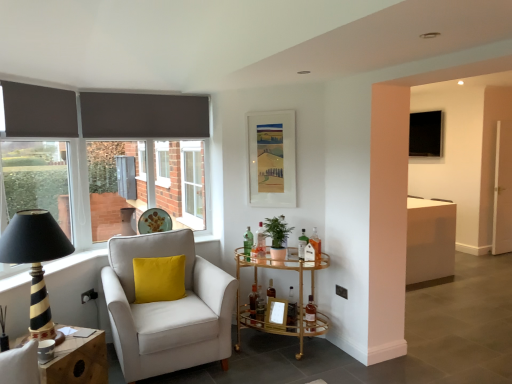
Measure the distance between green matte plant at center and camera.

They are 3.28 meters apart.

What is the approximate height of green glass bottle at center, the 3th bottle when ordered from left to right?

It is 13.46 inches.

Where is `green matte plant at center`? The image size is (512, 384). green matte plant at center is located at coordinates (277, 238).

Is point (345, 296) closer to camera compared to point (301, 245)?

No, (345, 296) is behind (301, 245).

From the image's perspective, which one is positioned higher, black plastic power outlet at lower right, which is the 2th power outlet in left-to-right order, or green glass bottle at center, the 3th bottle when ordered from right to left?

green glass bottle at center, the 3th bottle when ordered from right to left.

Which of these two, black plastic power outlet at lower right, placed as the 1th power outlet when sorted from right to left, or green glass bottle at center, the fifth bottle in the left-to-right sequence, is wider?

Wider between the two is green glass bottle at center, the fifth bottle in the left-to-right sequence.

How different are the orientations of black plastic power outlet at lower right, which is the 2th power outlet in left-to-right order, and green glass bottle at center, the 3th bottle when ordered from right to left, in degrees?

20.1 degrees separate the facing orientations of black plastic power outlet at lower right, which is the 2th power outlet in left-to-right order, and green glass bottle at center, the 3th bottle when ordered from right to left.

Who is more distant, yellow velvet pillow at center or green glass bottle at center, the 3th bottle when ordered from right to left?

green glass bottle at center, the 3th bottle when ordered from right to left, is more distant.

Would you consider yellow velvet pillow at center to be distant from green glass bottle at center, the fifth bottle in the left-to-right sequence?

Yes, yellow velvet pillow at center is far from green glass bottle at center, the fifth bottle in the left-to-right sequence.

Is yellow velvet pillow at center positioned beyond the bounds of green glass bottle at center, the 3th bottle when ordered from right to left?

That's correct, yellow velvet pillow at center is outside of green glass bottle at center, the 3th bottle when ordered from right to left.

Is yellow velvet pillow at center to the left of green glass bottle at center, the fifth bottle in the left-to-right sequence, from the viewer's perspective?

Correct, you'll find yellow velvet pillow at center to the left of green glass bottle at center, the fifth bottle in the left-to-right sequence.

From a real-world perspective, which is physically below, black plastic power outlet at lower left, arranged as the 2th power outlet when viewed from the right, or black glossy television at upper right?

black plastic power outlet at lower left, arranged as the 2th power outlet when viewed from the right, from a real-world perspective.

Is black plastic power outlet at lower left, the first power outlet in the left-to-right sequence, wider than black glossy television at upper right?

No, black plastic power outlet at lower left, the first power outlet in the left-to-right sequence, is not wider than black glossy television at upper right.

From the image's perspective, is black plastic power outlet at lower left, arranged as the 2th power outlet when viewed from the right, located above or below black glossy television at upper right?

Based on their image positions, black plastic power outlet at lower left, arranged as the 2th power outlet when viewed from the right, is located beneath black glossy television at upper right.

Would you consider black plastic power outlet at lower left, the first power outlet in the left-to-right sequence, to be distant from black glossy television at upper right?

Indeed, black plastic power outlet at lower left, the first power outlet in the left-to-right sequence, is not near black glossy television at upper right.

Considering the sizes of yellow velvet pillow at center and black glossy television at upper right in the image, is yellow velvet pillow at center wider or thinner than black glossy television at upper right?

yellow velvet pillow at center is wider than black glossy television at upper right.

Looking at this image, measure the distance between yellow velvet pillow at center and black glossy television at upper right.

They are 15.69 feet apart.

Locate an element on the screen. pillow on the left of black glossy television at upper right is located at coordinates (159, 279).

Can you confirm if yellow velvet pillow at center is taller than black glossy television at upper right?

No.

Can you confirm if white glass door at right is bigger than gold glass bar cart at center, the 2th table positioned from the left?

No.

Identify the location of glass door lying behind the gold glass bar cart at center, positioned as the first table in right-to-left order. (503, 190).

Considering the relative positions of white glass door at right and gold glass bar cart at center, positioned as the first table in right-to-left order, in the image provided, is white glass door at right behind gold glass bar cart at center, positioned as the first table in right-to-left order,?

Yes, white glass door at right is further from the camera.

Would you consider white plastic window frame at center to be distant from translucent amber glass bottle at center, the 6th bottle viewed from the left?

Indeed, white plastic window frame at center is not near translucent amber glass bottle at center, the 6th bottle viewed from the left.

This screenshot has height=384, width=512. I want to click on the 6th bottle in front of the white plastic window frame at center, so click(x=310, y=315).

Considering the sizes of objects white plastic window frame at center and translucent amber glass bottle at center, which is counted as the second bottle, starting from the right, in the image provided, who is thinner, white plastic window frame at center or translucent amber glass bottle at center, which is counted as the second bottle, starting from the right,?

translucent amber glass bottle at center, which is counted as the second bottle, starting from the right, is thinner.

Looking at this image, is translucent amber glass bottle at center, which is counted as the second bottle, starting from the right, a part of white plastic window frame at center?

No, translucent amber glass bottle at center, which is counted as the second bottle, starting from the right, is not surrounded by white plastic window frame at center.

Is yellow velvet pillow at center directly adjacent to translucent amber glass bottle at center, the 6th bottle viewed from the left?

No, yellow velvet pillow at center is not making contact with translucent amber glass bottle at center, the 6th bottle viewed from the left.

Image resolution: width=512 pixels, height=384 pixels. I want to click on the 1st bottle behind when counting from the yellow velvet pillow at center, so click(310, 315).

From the image's perspective, is yellow velvet pillow at center beneath translucent amber glass bottle at center, which is counted as the second bottle, starting from the right?

No.

Is yellow velvet pillow at center wider than translucent amber glass bottle at center, which is counted as the second bottle, starting from the right?

Yes.

Where is `the 2nd power outlet below the green glass bottle at center, the fifth bottle in the left-to-right sequence (from a real-world perspective)`? The image size is (512, 384). the 2nd power outlet below the green glass bottle at center, the fifth bottle in the left-to-right sequence (from a real-world perspective) is located at coordinates (341, 291).

Locate an element on the screen. The height and width of the screenshot is (384, 512). the 5th bottle counting from the right of the yellow velvet pillow at center is located at coordinates (302, 244).

Which object lies nearer to the anchor point green glass bottle at center, the 3th bottle when ordered from right to left, white plastic window frame at center or gold glass bar cart at center, positioned as the first table in right-to-left order?

The object closer to green glass bottle at center, the 3th bottle when ordered from right to left, is gold glass bar cart at center, positioned as the first table in right-to-left order.

Considering their positions, is clear glass bottle at center, arranged as the fourth bottle when viewed from the left, positioned further to wooden side table at lower left, the second table from the right, than gold glass bar cart at center, which ranks as the second table in front-to-back order?

clear glass bottle at center, arranged as the fourth bottle when viewed from the left, is positioned further to the anchor wooden side table at lower left, the second table from the right.

Considering their positions, is black plastic power outlet at lower right, placed as the 1th power outlet when sorted from right to left, positioned further to matte paper picture frame at center than gold glass bar cart at center, which is the first table from back to front?

Based on the image, black plastic power outlet at lower right, placed as the 1th power outlet when sorted from right to left, appears to be further to matte paper picture frame at center.

Looking at the image, which one is located further to black striped wood table lamp at left, black plastic power outlet at lower left, the first power outlet in the left-to-right sequence, or white fabric armchair at left?

black plastic power outlet at lower left, the first power outlet in the left-to-right sequence, is positioned further to the anchor black striped wood table lamp at left.

Estimate the real-world distances between objects in this image. Which object is further from clear glass bottle at center, the fourth bottle positioned from the right, translucent glass bottle at center, the 6th bottle in the right-to-left sequence, or black glossy television at upper right?

Among the two, black glossy television at upper right is located further to clear glass bottle at center, the fourth bottle positioned from the right.

Based on their spatial positions, is white fabric armchair at left or white glass door at right further from wooden side table at lower left, the second table from the right?

The object further to wooden side table at lower left, the second table from the right, is white glass door at right.

From the picture: Estimate the real-world distances between objects in this image. Which object is further from green glass bottle at center, the 3th bottle when ordered from left to right, translucent glass bottle at center, the first bottle from the right, or black striped wood table lamp at left?

The object further to green glass bottle at center, the 3th bottle when ordered from left to right, is black striped wood table lamp at left.

Estimate the real-world distances between objects in this image. Which object is closer to white fabric armchair at left, matte paper picture frame at center or clear glass bottle at center, arranged as the fourth bottle when viewed from the left?

Based on the image, clear glass bottle at center, arranged as the fourth bottle when viewed from the left, appears to be nearer to white fabric armchair at left.

This screenshot has width=512, height=384. In order to click on chair between matte paper picture frame at center and translucent amber glass bottle at center, the 6th bottle viewed from the left, from top to bottom in this screenshot , I will do `click(167, 309)`.

Locate an element on the screen. window frame situated between black plastic power outlet at lower left, the first power outlet in the left-to-right sequence, and gold glass bar cart at center, the 2th table positioned from the left, from left to right is located at coordinates (192, 184).

Where is `lamp situated between black plastic power outlet at lower left, the first power outlet in the left-to-right sequence, and gold glass bar cart at center, positioned as the first table in right-to-left order, from left to right`? lamp situated between black plastic power outlet at lower left, the first power outlet in the left-to-right sequence, and gold glass bar cart at center, positioned as the first table in right-to-left order, from left to right is located at coordinates (35, 260).

The width and height of the screenshot is (512, 384). I want to click on window frame located between matte gray roller blind at left and white glass door at right in the left-right direction, so click(192, 184).